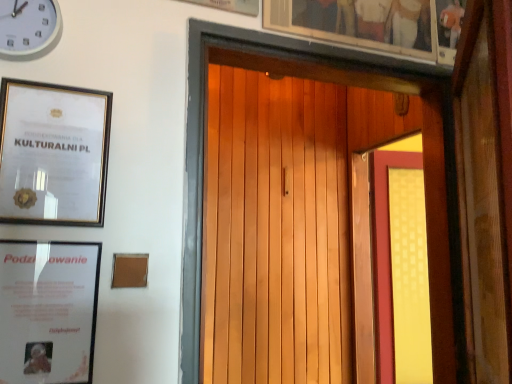
Question: From the image's perspective, is wooden picture frame at upper center, the third picture frame in the left-to-right sequence, located beneath wooden picture frame at upper center, the first picture frame when ordered from right to left?

Choices:
 (A) yes
 (B) no

Answer: (B)

Question: From a real-world perspective, is wooden picture frame at upper center, the first picture frame viewed from the top, physically above wooden picture frame at upper center, positioned as the 3th picture frame in bottom-to-top order?

Choices:
 (A) no
 (B) yes

Answer: (B)

Question: Would you say wooden picture frame at upper center, the third picture frame in the left-to-right sequence, is outside wooden picture frame at upper center, which ranks as the second picture frame in top-to-bottom order?

Choices:
 (A) yes
 (B) no

Answer: (A)

Question: Is wooden picture frame at upper center, the 4th picture frame from the bottom, further to camera compared to wooden picture frame at upper center, the 4th picture frame positioned from the left?

Choices:
 (A) no
 (B) yes

Answer: (A)

Question: Is the position of wooden picture frame at upper center, the third picture frame in the left-to-right sequence, less distant than that of wooden picture frame at upper center, which ranks as the second picture frame in top-to-bottom order?

Choices:
 (A) yes
 (B) no

Answer: (A)

Question: Is white plastic clock at upper left inside or outside of gold-framed certificate at upper left, the second picture frame from the left?

Choices:
 (A) outside
 (B) inside

Answer: (A)

Question: Is white plastic clock at upper left in front of or behind gold-framed certificate at upper left, which ranks as the second picture frame in bottom-to-top order, in the image?

Choices:
 (A) behind
 (B) front

Answer: (B)

Question: Considering the positions of white plastic clock at upper left and gold-framed certificate at upper left, which ranks as the second picture frame in bottom-to-top order, in the image, is white plastic clock at upper left taller or shorter than gold-framed certificate at upper left, which ranks as the second picture frame in bottom-to-top order,?

Choices:
 (A) short
 (B) tall

Answer: (A)

Question: From the image's perspective, is white plastic clock at upper left positioned above or below gold-framed certificate at upper left, the 3th picture frame from the right?

Choices:
 (A) below
 (B) above

Answer: (B)

Question: Is yellow matte screen door at right wider or thinner than wooden picture frame at upper center, the first picture frame when ordered from right to left?

Choices:
 (A) wide
 (B) thin

Answer: (B)

Question: Which is correct: yellow matte screen door at right is inside wooden picture frame at upper center, which ranks as the second picture frame in top-to-bottom order, or outside of it?

Choices:
 (A) inside
 (B) outside

Answer: (B)

Question: Would you say yellow matte screen door at right is to the left or to the right of wooden picture frame at upper center, positioned as the 3th picture frame in bottom-to-top order, in the picture?

Choices:
 (A) left
 (B) right

Answer: (B)

Question: From a real-world perspective, relative to wooden picture frame at upper center, positioned as the 3th picture frame in bottom-to-top order, is yellow matte screen door at right vertically above or below?

Choices:
 (A) below
 (B) above

Answer: (A)

Question: Considering the positions of matte white picture frame at lower left, which ranks as the fourth picture frame in top-to-bottom order, and wooden picture frame at upper center, which is counted as the 2th picture frame, starting from the right, in the image, is matte white picture frame at lower left, which ranks as the fourth picture frame in top-to-bottom order, bigger or smaller than wooden picture frame at upper center, which is counted as the 2th picture frame, starting from the right,?

Choices:
 (A) big
 (B) small

Answer: (B)

Question: Would you say matte white picture frame at lower left, which is the 1th picture frame in left-to-right order, is to the left or to the right of wooden picture frame at upper center, the 4th picture frame from the bottom, in the picture?

Choices:
 (A) right
 (B) left

Answer: (B)